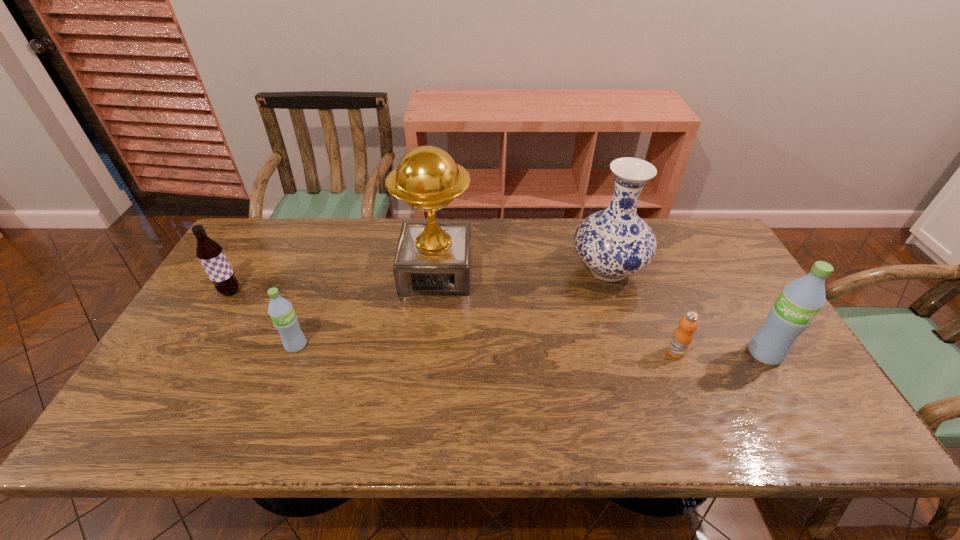
Please point a location where one more water_bottle can be added evenly. Please provide its 2D coordinates. Your answer should be formatted as a tuple, i.e. [(x, y)], where the tuple contains the x and y coordinates of a point satisfying the conditions above.

[(528, 349)]